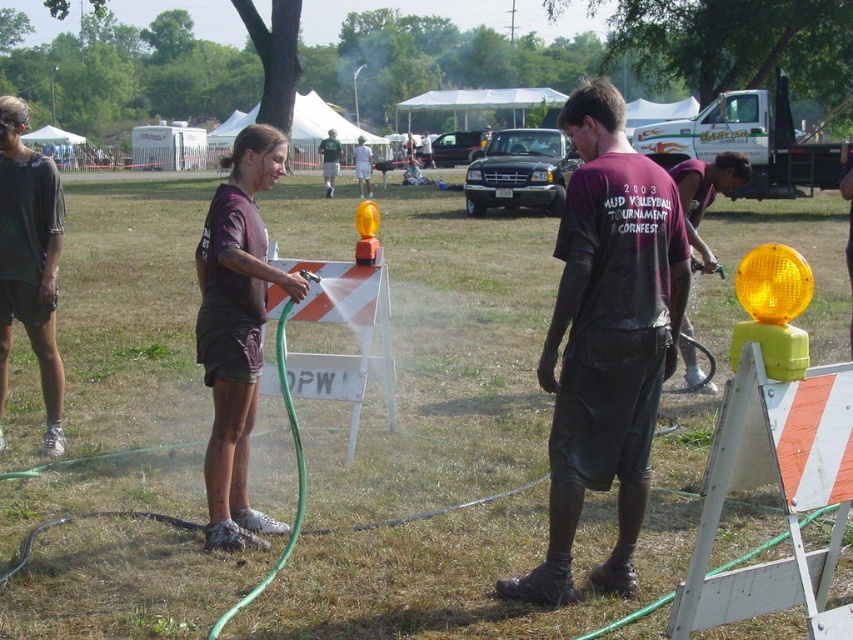
You are a participant in the Mud Volleyball Tournament Cornfest. You are standing at the edge of the field and see the dark brown mud at center and the dark brown shorts at center. Which object is positioned to the right of the other?

The dark brown mud at center is to the right of the dark brown shorts at center.

Based on the photo, you are a photographer at the event and need to capture both the matte black shirt at center and the green fabric shirt at center in a single photo. Can you frame the shot so that both are fully visible without any part of either shirt being cut off?

The matte black shirt at center is in front of the green fabric shirt at center, so as long as you position the camera to include both the front and back shirts in the frame, both will be fully visible.